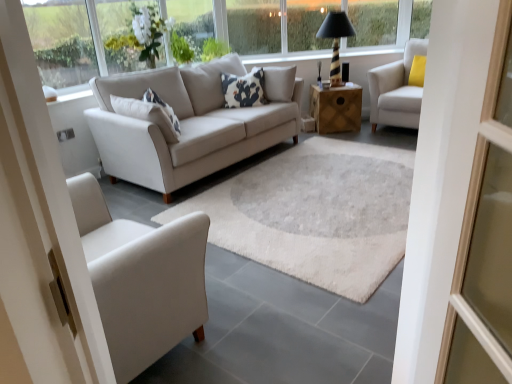
Question: In the image, is wooden side table at center positioned in front of or behind white fabric armchair at upper right?

Choices:
 (A) front
 (B) behind

Answer: (B)

Question: From a real-world perspective, is wooden side table at center above or below white fabric armchair at upper right?

Choices:
 (A) below
 (B) above

Answer: (A)

Question: Which is farther from the transparent glass window at upper center, marked as the second window in a right-to-left arrangement?

Choices:
 (A) clear glass window at upper center, which is the 3th window in left-to-right order
 (B) transparent glass window at upper left, positioned as the 1th window in left-to-right order
 (C) black striped lamp at upper right
 (D) white fabric armchair at upper right
 (E) white cotton pillow at center

Answer: (B)

Question: Considering the real-world distances, which object is closest to the white cotton pillow at center?

Choices:
 (A) transparent glass window at upper center, the 5th window from the left
 (B) transparent glass window at upper left, marked as the sixth window in a right-to-left arrangement
 (C) wooden side table at center
 (D) transparent glass window at upper center, which is the 3th window in right-to-left order
 (E) transparent glass window at upper center, which ranks as the second window in left-to-right order

Answer: (C)